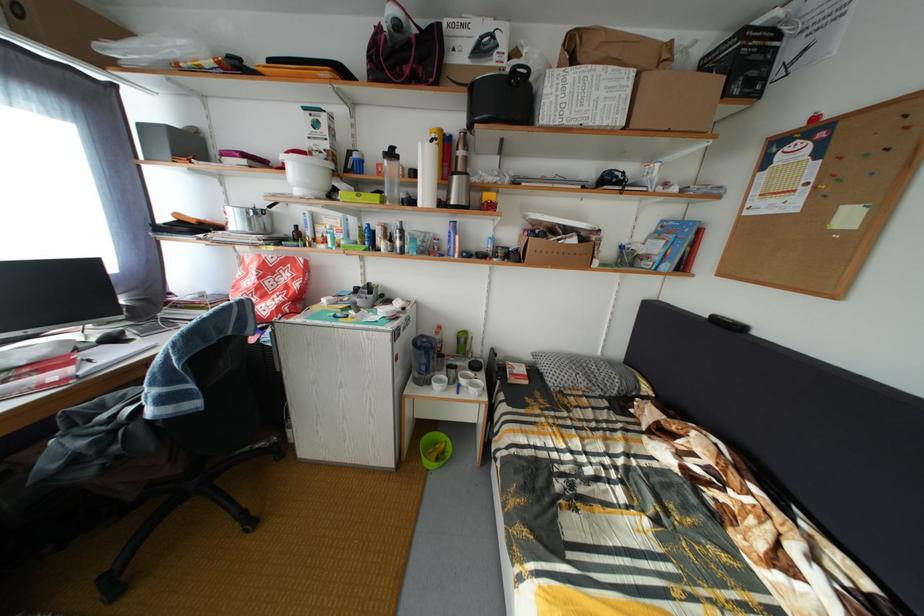
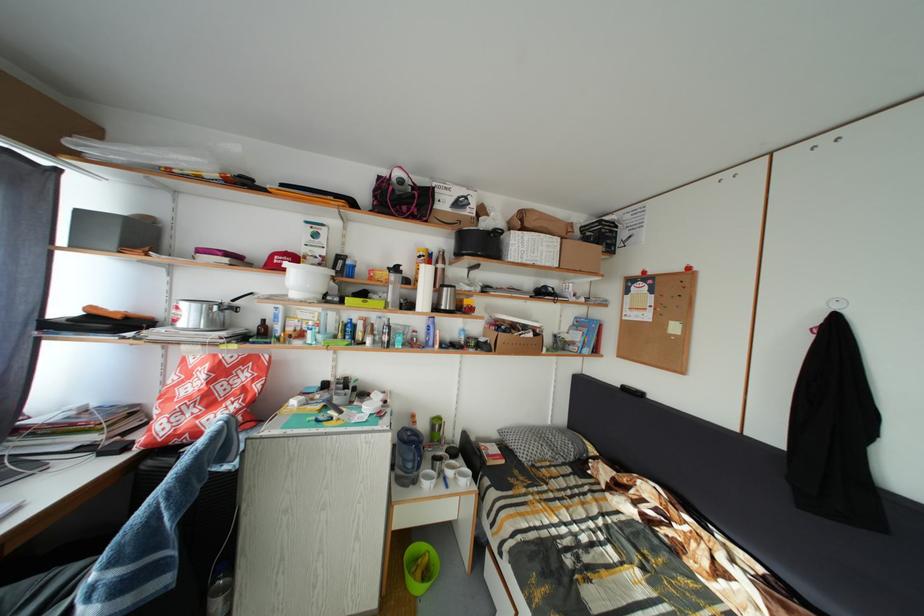
Locate, in the second image, the point that corresponds to [438,390] in the first image.

(423, 488)